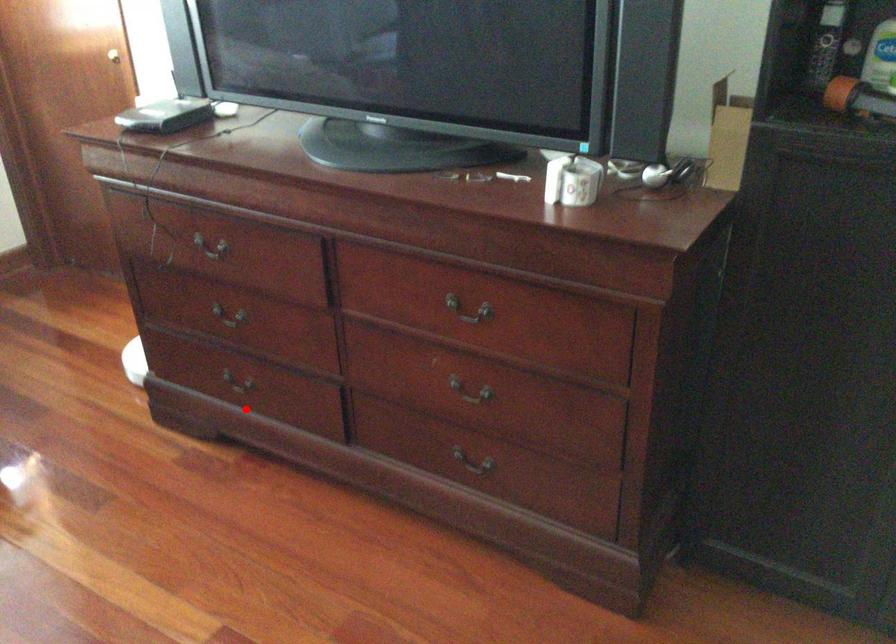
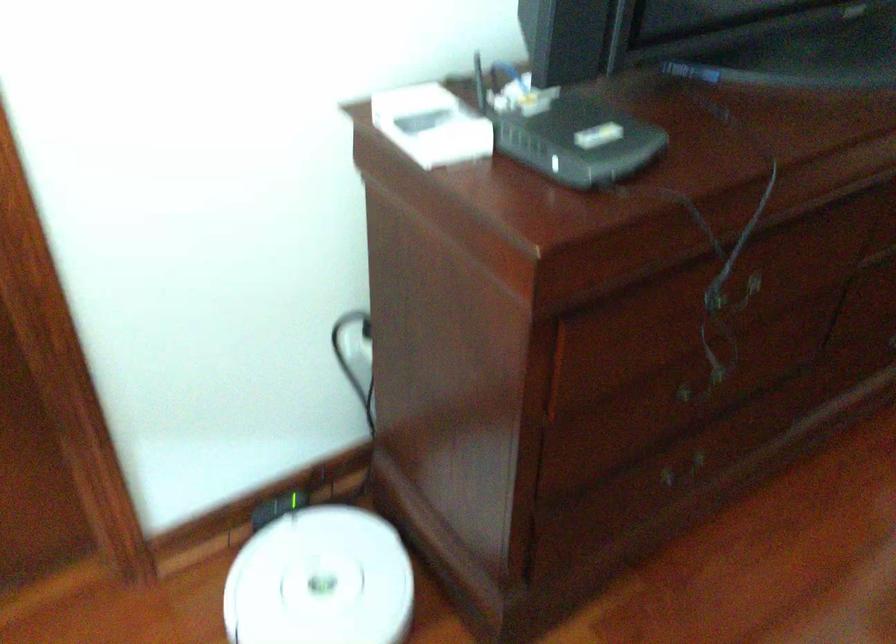
Question: A red point is marked in image1. In image2, is the corresponding 3D point closer to the camera or farther? Reply with the corresponding letter.

Choices:
 (A) The corresponding 3D point is closer.
 (B) The corresponding 3D point is farther.

Answer: (A)